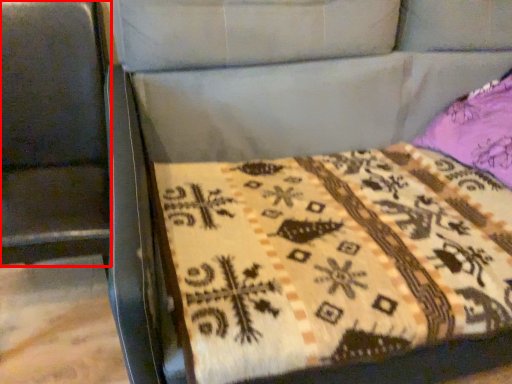
Question: From the image's perspective, where is swivel chair (annotated by the red box) located relative to quilt?

Choices:
 (A) below
 (B) above

Answer: (B)